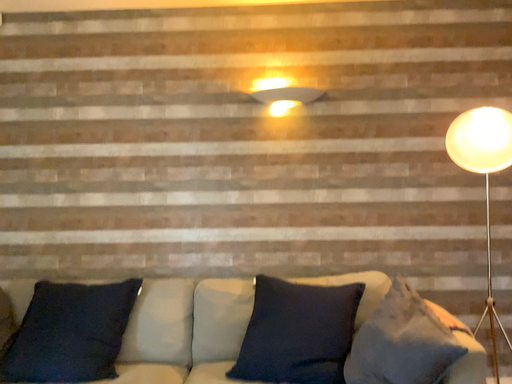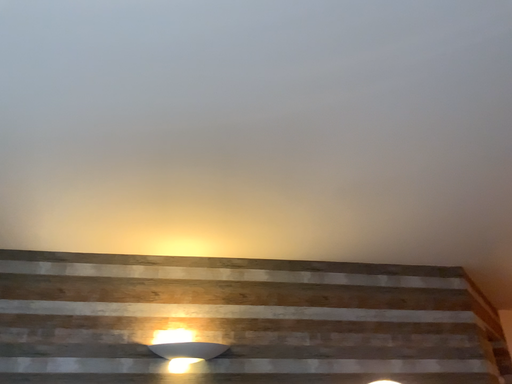
Question: How did the camera likely rotate when shooting the video?

Choices:
 (A) rotated upward
 (B) rotated downward

Answer: (A)